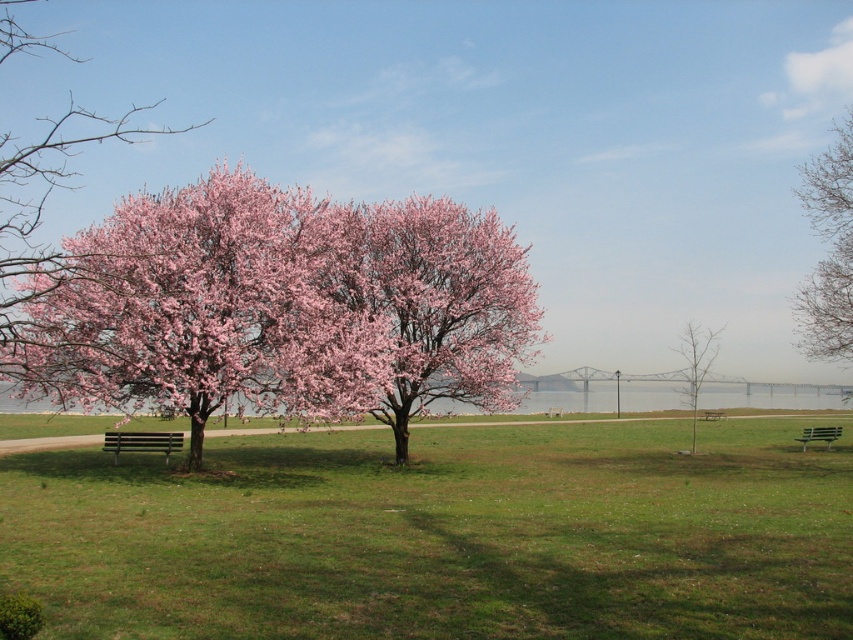
Looking at this image, is bare wood tree at center shorter than wooden park bench at center?

No, bare wood tree at center is not shorter than wooden park bench at center.

Between bare wood tree at center and wooden park bench at center, which one appears on the left side from the viewer's perspective?

Positioned to the left is bare wood tree at center.

Is point (685, 372) positioned behind point (717, 419)?

Yes.

Locate an element on the screen. bare wood tree at center is located at coordinates pyautogui.click(x=695, y=364).

Is pink bloom at center positioned in front of bare wood tree at center?

Yes, pink bloom at center is in front of bare wood tree at center.

Is point (218, 266) closer to viewer compared to point (708, 365)?

That is True.

The height and width of the screenshot is (640, 853). What are the coordinates of `pink bloom at center` in the screenshot? It's located at (286, 305).

The image size is (853, 640). What do you see at coordinates (286, 305) in the screenshot?
I see `pink bloom at center` at bounding box center [286, 305].

Is point (99, 396) in front of point (109, 435)?

Yes, it is.

Locate an element on the screen. pink bloom at center is located at coordinates (286, 305).